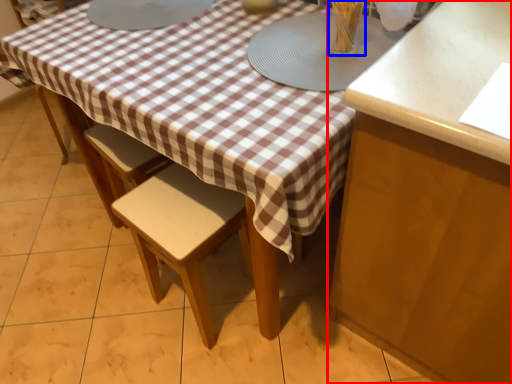
Question: Among these objects, which one is farthest to the camera, cabinetry (highlighted by a red box) or tableware (highlighted by a blue box)?

Choices:
 (A) cabinetry
 (B) tableware

Answer: (B)